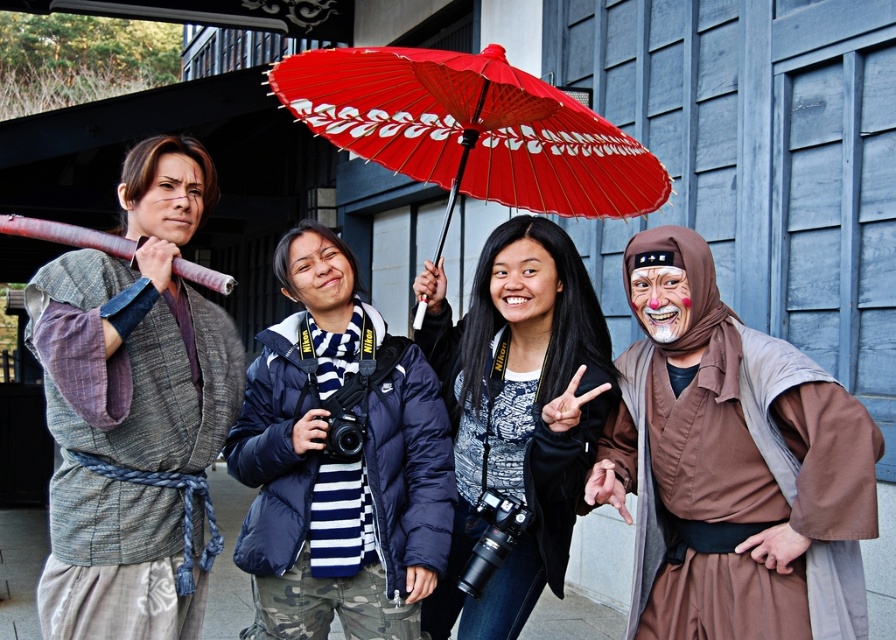
Question: Which object is closer to the camera taking this photo?

Choices:
 (A) red paper umbrella at center
 (B) navy blue puffer jacket at center
 (C) matte black jacket at center

Answer: (C)

Question: Does brown fabric mask at right come behind red paper umbrella at center?

Choices:
 (A) no
 (B) yes

Answer: (A)

Question: Does matte gray kimono at left appear on the left side of navy blue puffer jacket at center?

Choices:
 (A) yes
 (B) no

Answer: (A)

Question: Among these points, which one is farthest from the camera?

Choices:
 (A) (100, 548)
 (B) (535, 440)

Answer: (B)

Question: Can you confirm if brown fabric mask at right is bigger than matte gray kimono at left?

Choices:
 (A) yes
 (B) no

Answer: (A)

Question: Estimate the real-world distances between objects in this image. Which object is farther from the brown fabric mask at right?

Choices:
 (A) navy blue puffer jacket at center
 (B) red paper umbrella at center

Answer: (B)